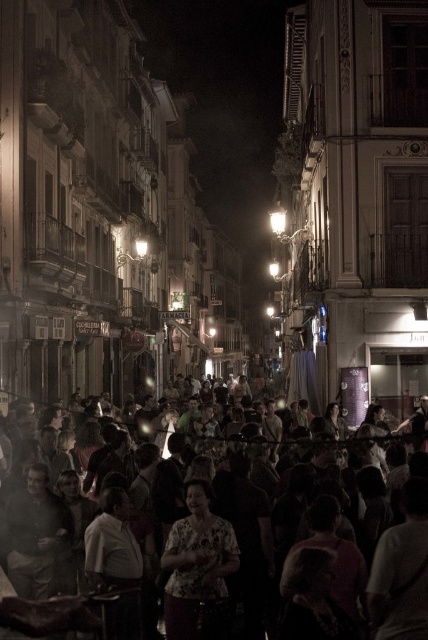
Question: Which point appears closest to the camera in this image?

Choices:
 (A) (199, 605)
 (B) (397, 509)

Answer: (A)

Question: Is the position of multicolored fabric crowd at center less distant than that of floral print blouse at center?

Choices:
 (A) yes
 (B) no

Answer: (B)

Question: Which of the following is the closest to the observer?

Choices:
 (A) (225, 532)
 (B) (344, 442)

Answer: (A)

Question: Can you confirm if multicolored fabric crowd at center is bigger than floral print blouse at center?

Choices:
 (A) no
 (B) yes

Answer: (B)

Question: Does multicolored fabric crowd at center have a lesser width compared to floral print blouse at center?

Choices:
 (A) no
 (B) yes

Answer: (A)